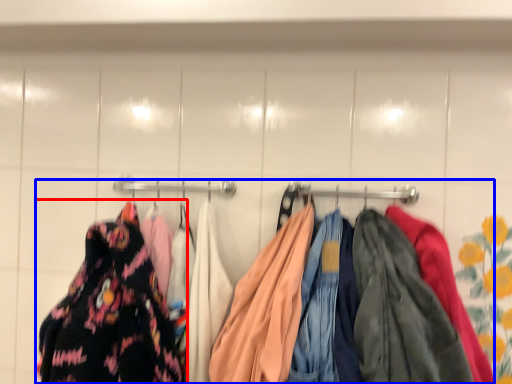
Question: Among these objects, which one is nearest to the camera, fancy dress (highlighted by a red box) or laundry (highlighted by a blue box)?

Choices:
 (A) fancy dress
 (B) laundry

Answer: (B)